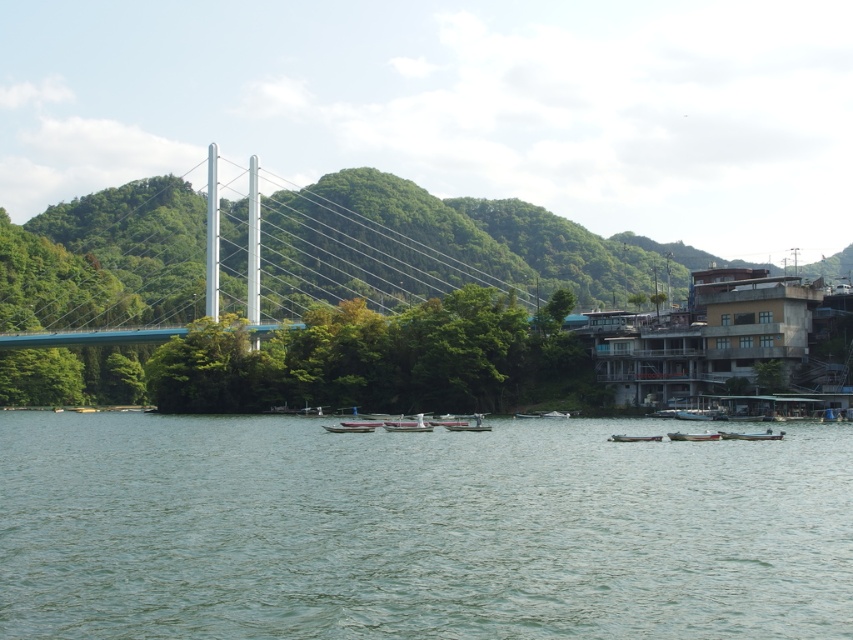
Is wooden boat at lower right thinner than white plastic boat at center?

Incorrect, wooden boat at lower right's width is not less than white plastic boat at center's.

Who is positioned more to the left, wooden boat at lower right or white plastic boat at center?

white plastic boat at center is more to the left.

This screenshot has width=853, height=640. Describe the element at coordinates (752, 435) in the screenshot. I see `wooden boat at lower right` at that location.

At what (x,y) coordinates should I click in order to perform the action: click on wooden boat at lower right. Please return your answer as a coordinate pair (x, y). The height and width of the screenshot is (640, 853). Looking at the image, I should click on (752, 435).

Who is positioned more to the left, green water at center or wooden boat at center?

From the viewer's perspective, green water at center appears more on the left side.

Is green water at center to the left of wooden boat at center from the viewer's perspective?

Correct, you'll find green water at center to the left of wooden boat at center.

This screenshot has width=853, height=640. In order to click on green water at center in this screenshot , I will do `click(418, 529)`.

Which is below, blue metallic suspension bridge at center or wooden boat at center?

wooden boat at center is lower down.

At what (x,y) coordinates should I click in order to perform the action: click on blue metallic suspension bridge at center. Please return your answer as a coordinate pair (x, y). The image size is (853, 640). Looking at the image, I should click on (233, 259).